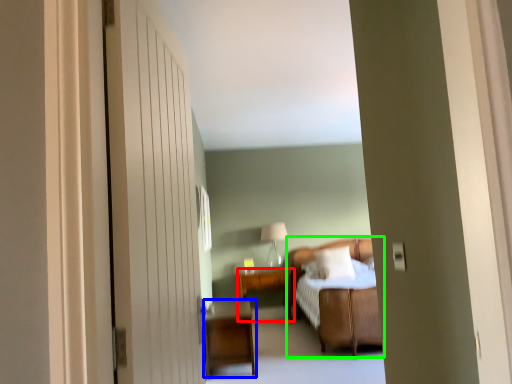
Question: Which object is positioned closest to table (highlighted by a red box)? Select from nightstand (highlighted by a blue box) and bed (highlighted by a green box).

Choices:
 (A) nightstand
 (B) bed

Answer: (B)